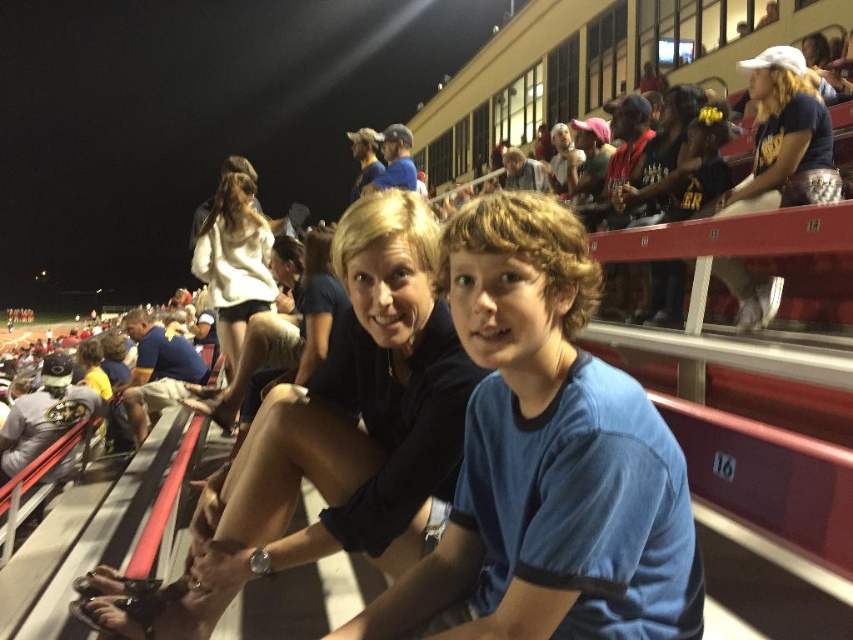
Question: Does blue cotton shirt at center appear over white soft sweater at upper center?

Choices:
 (A) yes
 (B) no

Answer: (A)

Question: Observing the image, what is the correct spatial positioning of matte black shirt at center in reference to white matte baseball cap at upper right?

Choices:
 (A) right
 (B) left

Answer: (B)

Question: Which point is farther to the camera?

Choices:
 (A) blue cotton shirt at center
 (B) white matte baseball cap at upper right
 (C) matte black shirt at center

Answer: (B)

Question: Does blue cotton shirt at center have a greater width compared to white matte baseball cap at upper right?

Choices:
 (A) yes
 (B) no

Answer: (A)

Question: Which object is the closest to the white matte baseball cap at upper right?

Choices:
 (A) matte black shirt at center
 (B) white soft sweater at upper center
 (C) blue cotton shirt at center

Answer: (C)

Question: Which of the following is the closest to the observer?

Choices:
 (A) (426, 358)
 (B) (761, 51)
 (C) (234, 205)
 (D) (585, 586)

Answer: (D)